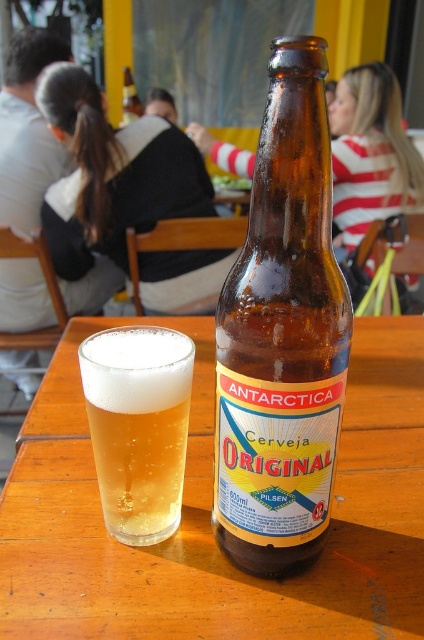
You are setting up a picnic and have a wooden table at center and a brown glass bottle at center. Which object is located to the right of the other?

The brown glass bottle at center is to the right of the wooden table at center because the wooden table at center is positioned on the left side of the brown glass bottle at center.

You are a bartender who needs to pour beer into a glass. The clear glass beer at center and the brown glass bottle at upper center are both on the table. Which container should you use to pour the beer if you want the liquid to reach a height of 10 cm?

The clear glass beer at center is shorter than the brown glass bottle at upper center. Since the desired height is 10 cm, the brown glass bottle at upper center can accommodate the liquid to reach that height, while the shorter glass may overflow. Therefore, you should use the brown glass bottle at upper center.

You are setting up a table for a party and need to arrange the clear glass beer at center and the brown glass bottle at upper center. If you want to place them side by side with equal spacing between them and the edges of the table, which item should be placed closer to the edge to maintain balance?

The clear glass beer at center should be placed closer to the edge because its width is less than the brown glass bottle at upper center, so to balance the spacing, the narrower item needs to be closer to the edge.